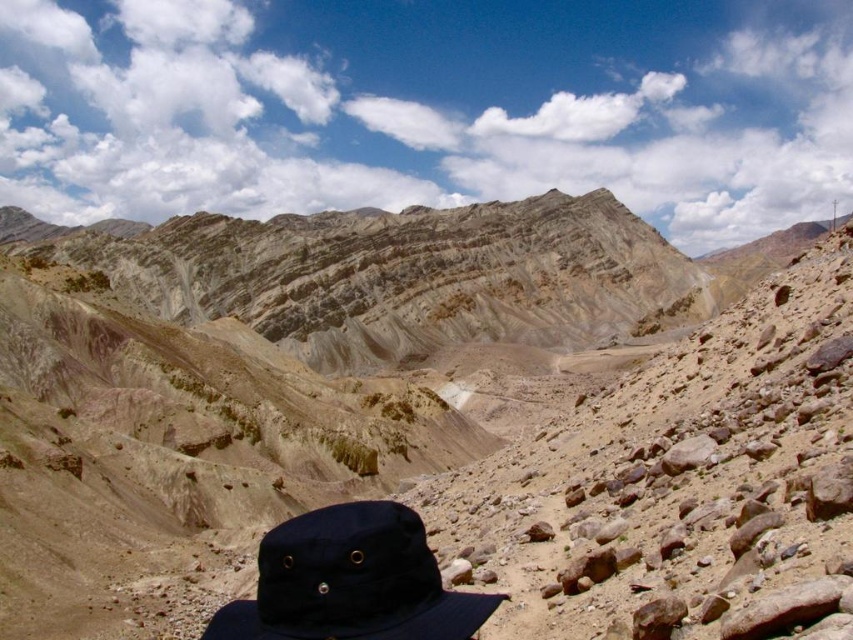
You are an explorer in the desert and need to decide which object to use as a marker. The matte brown rock at center and the navy blue fabric baseball hat at lower center are both available. Which one has a larger width and would be more visible from a distance?

The matte brown rock at center has a larger width than the navy blue fabric baseball hat at lower center, making it more visible from a distance.

You are hiking in the arid landscape and want to pick up the navy blue fabric baseball hat at lower center. Which object is closer to you, the matte brown rock at center or the hat?

The matte brown rock at center is closer to you than the navy blue fabric baseball hat at lower center.